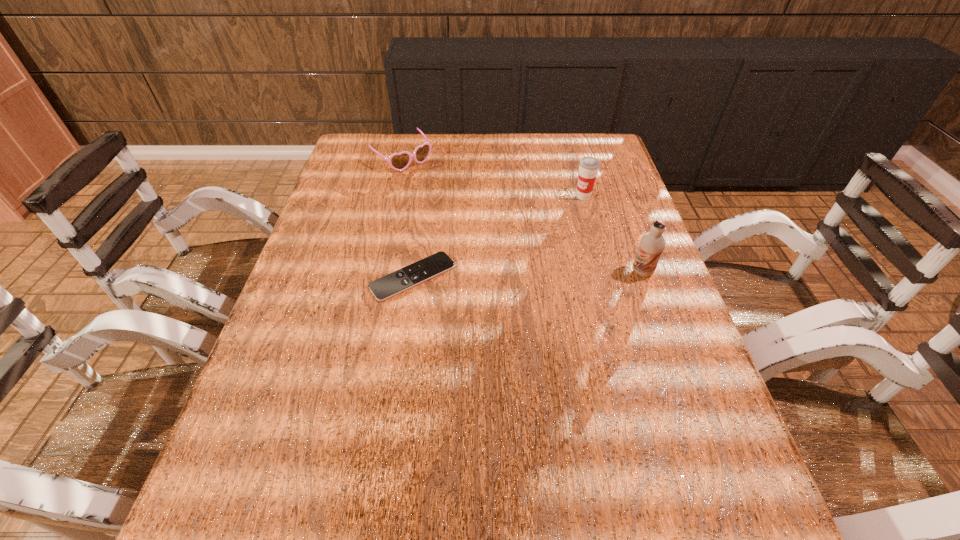
Identify the location of vacant position located on the side of the third nearest object with the logo. The image size is (960, 540). (546, 241).

You are a GUI agent. You are given a task and a screenshot of the screen. Output one action in this format:
    pyautogui.click(x=<x>, y=<y>)
    Task: Click on the vacant space located on the front-facing side of the second shortest object
    The image size is (960, 540).
    Given the screenshot: What is the action you would take?
    pyautogui.click(x=428, y=180)

The height and width of the screenshot is (540, 960). I want to click on free space located on the front-facing side of the second shortest object, so click(x=444, y=194).

Where is `vacant space situated 0.130m on the front-facing side of the second shortest object`? vacant space situated 0.130m on the front-facing side of the second shortest object is located at coordinates (440, 191).

The image size is (960, 540). I want to click on object positioned at the far edge, so [400, 161].

You are a GUI agent. You are given a task and a screenshot of the screen. Output one action in this format:
    pyautogui.click(x=<x>, y=<y>)
    Task: Click on the object located at the left edge
    This screenshot has height=540, width=960.
    Given the screenshot: What is the action you would take?
    pyautogui.click(x=400, y=161)

The width and height of the screenshot is (960, 540). In order to click on chocolate milk that is at the right edge in this screenshot , I will do `click(652, 244)`.

Where is `cup that is at the right edge`? Image resolution: width=960 pixels, height=540 pixels. cup that is at the right edge is located at coordinates (588, 166).

The height and width of the screenshot is (540, 960). What are the coordinates of `object that is positioned at the far left corner` in the screenshot? It's located at (400, 161).

Identify the location of vacant point at the far edge. This screenshot has width=960, height=540. (456, 156).